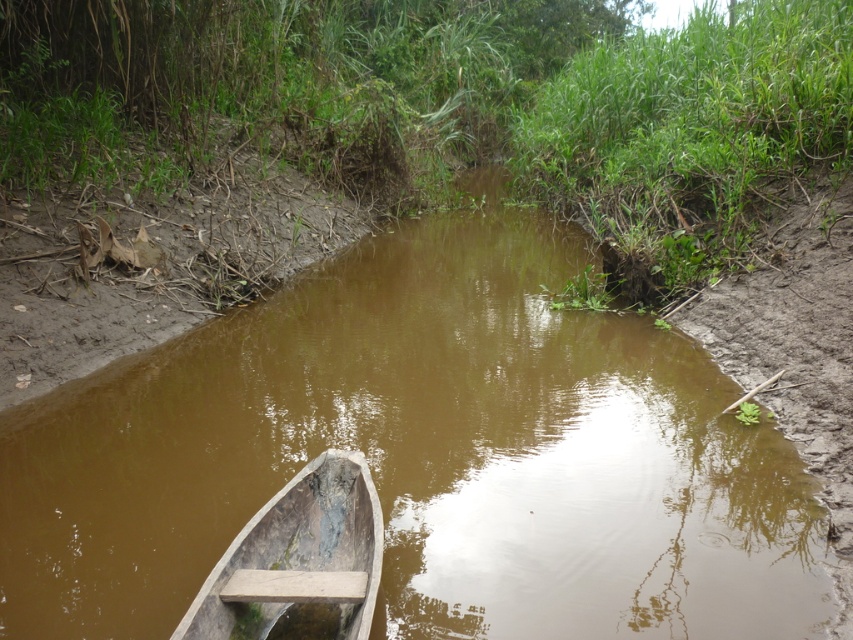
Does green grass at center come in front of wooden boat at lower left?

No.

Image resolution: width=853 pixels, height=640 pixels. What do you see at coordinates (447, 100) in the screenshot?
I see `green grass at center` at bounding box center [447, 100].

This screenshot has height=640, width=853. Describe the element at coordinates (447, 100) in the screenshot. I see `green grass at center` at that location.

This screenshot has width=853, height=640. I want to click on green grass at center, so click(447, 100).

Is brown muddy stream at center further to camera compared to wooden plank at lower left?

No.

Consider the image. Does brown muddy stream at center come in front of wooden plank at lower left?

Yes, it is in front of wooden plank at lower left.

Measure the distance between point (30, 531) and camera.

A distance of 5.99 meters exists between point (30, 531) and camera.

The height and width of the screenshot is (640, 853). In order to click on brown muddy stream at center in this screenshot , I will do `click(422, 456)`.

Is green grass at center to the right of wooden plank at lower left from the viewer's perspective?

Yes, green grass at center is to the right of wooden plank at lower left.

Is point (558, 160) positioned before point (357, 573)?

No, it is behind (357, 573).

The width and height of the screenshot is (853, 640). In order to click on green grass at center in this screenshot , I will do `click(447, 100)`.